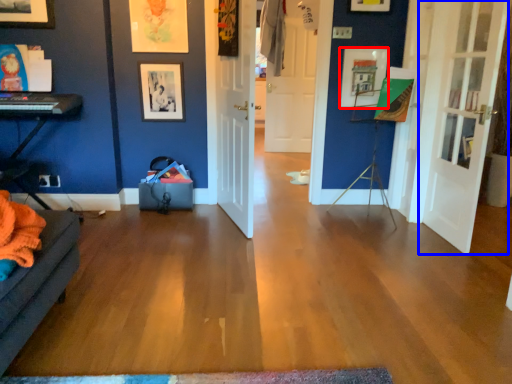
Question: Which object appears closest to the camera in this image, picture frame (highlighted by a red box) or door (highlighted by a blue box)?

Choices:
 (A) picture frame
 (B) door

Answer: (B)